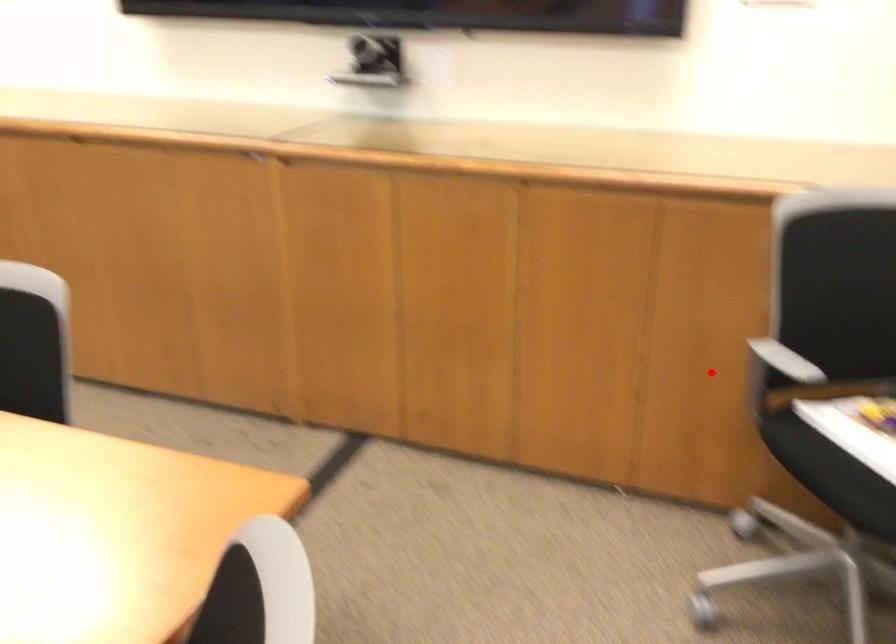
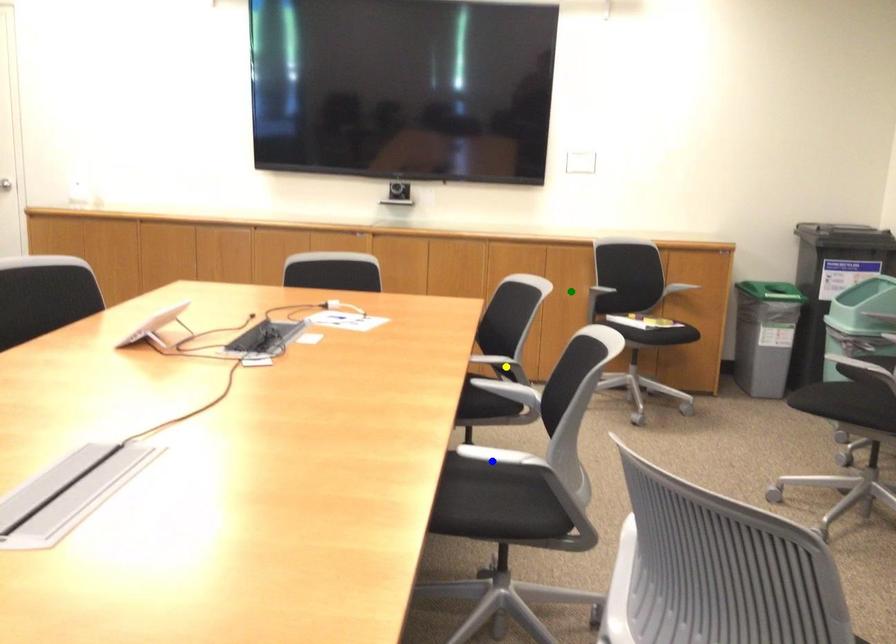
Question: I am providing you with two images of the same scene from different viewpoints. A red point is marked on the first image. You are given multiple points on the second image. Which mark in image 2 goes with the point in image 1?

Choices:
 (A) yellow point
 (B) green point
 (C) blue point

Answer: (B)